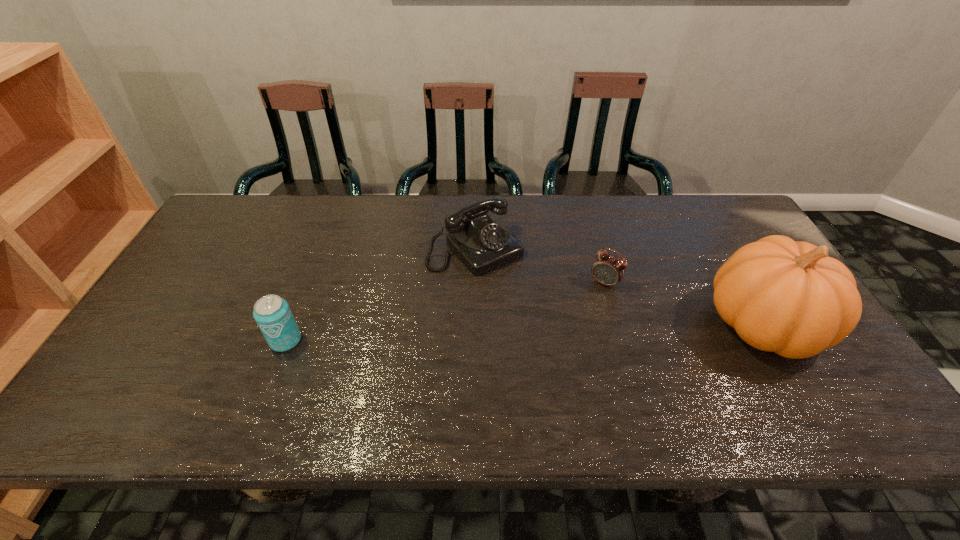
Locate an element on the screen. Image resolution: width=960 pixels, height=540 pixels. free space on the desktop that is between the leftmost object and the pumpkin and is positioned on the face of the alarm clock is located at coordinates (572, 331).

This screenshot has height=540, width=960. What are the coordinates of `free space on the desktop that is between the beer can and the tallest object and is positioned on the dial of the telephone` in the screenshot? It's located at (551, 332).